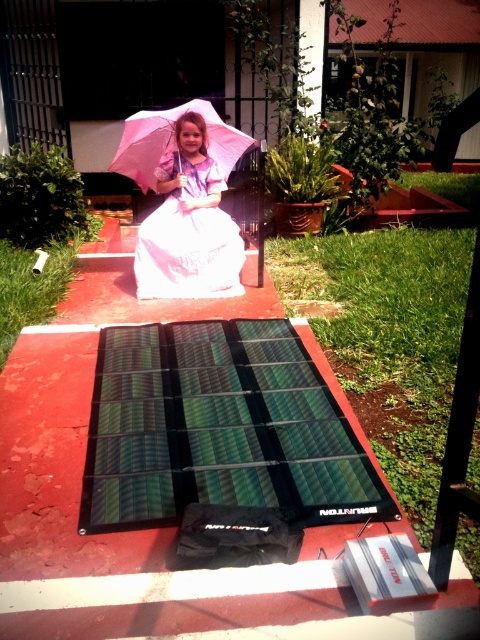
Question: Which of these objects is positioned closest to the green flexible solar panel at center?

Choices:
 (A) pink fabric umbrella at center
 (B) purple satin dress at center

Answer: (B)

Question: Which point appears farthest from the camera in this image?

Choices:
 (A) (213, 403)
 (B) (129, 125)
 (C) (142, 296)

Answer: (B)

Question: Does green flexible solar panel at center appear over pink fabric umbrella at center?

Choices:
 (A) yes
 (B) no

Answer: (B)

Question: Can you confirm if purple satin dress at center is thinner than pink fabric umbrella at center?

Choices:
 (A) yes
 (B) no

Answer: (A)

Question: Considering the real-world distances, which object is closest to the green flexible solar panel at center?

Choices:
 (A) purple satin dress at center
 (B) pink fabric umbrella at center

Answer: (A)

Question: Is purple satin dress at center smaller than pink fabric umbrella at center?

Choices:
 (A) yes
 (B) no

Answer: (A)